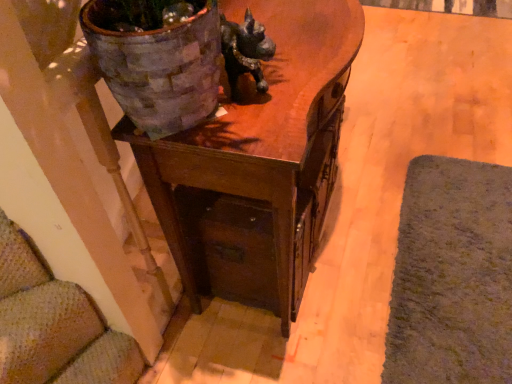
The width and height of the screenshot is (512, 384). I want to click on empty space that is to the right of wooden cabinet at center, so click(394, 183).